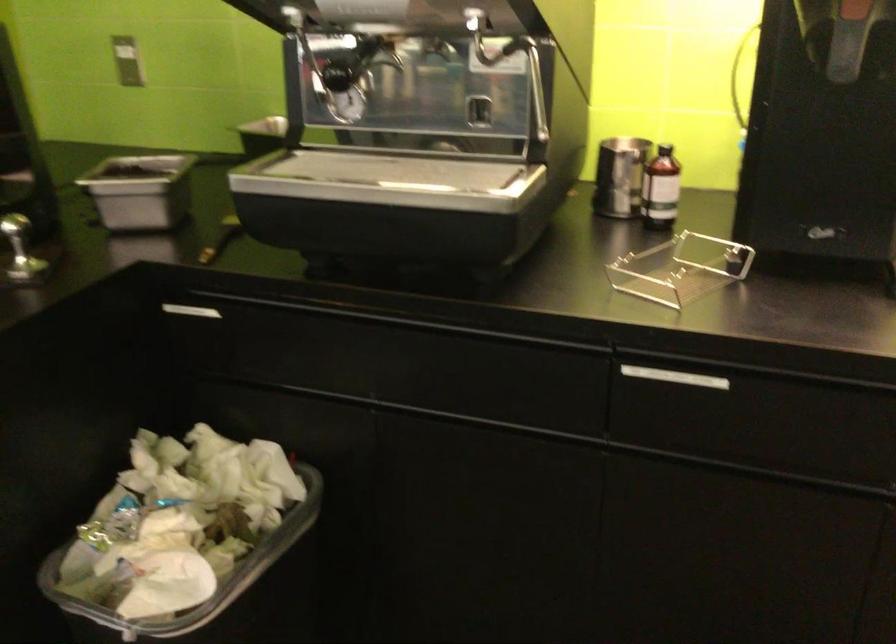
What do you see at coordinates (666, 152) in the screenshot?
I see `the black bottle cap` at bounding box center [666, 152].